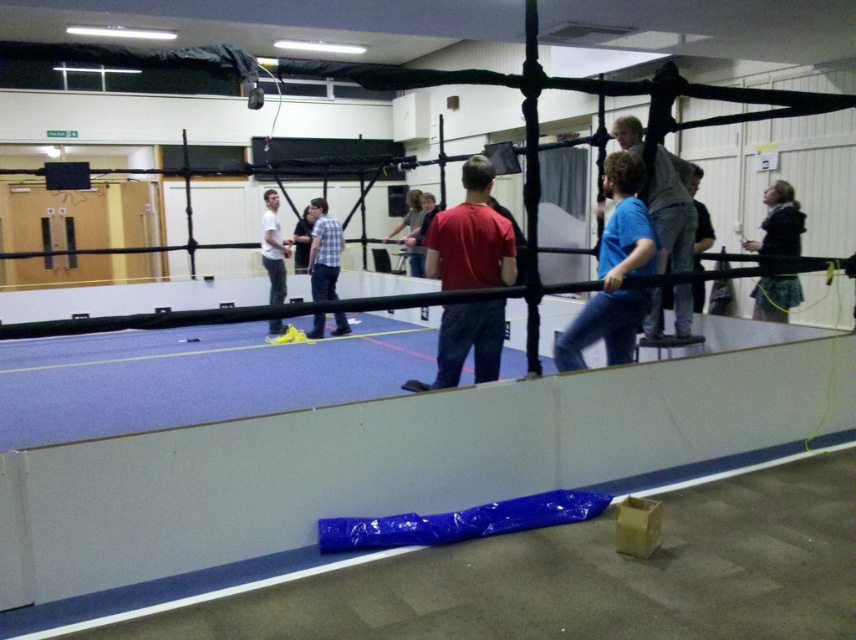
Question: Does blue matte shirt at center have a larger size compared to plaid fabric shirt at center?

Choices:
 (A) no
 (B) yes

Answer: (A)

Question: Which of the following is the farthest from the observer?

Choices:
 (A) (434, 264)
 (B) (284, 330)
 (C) (599, 339)
 (D) (310, 337)

Answer: (B)

Question: Which object is the closest to the white matte shirt at center?

Choices:
 (A) dark blue textured skirt at right
 (B) blue matte shirt at center
 (C) plaid fabric shirt at center

Answer: (C)

Question: Can you confirm if red matte shirt at center is positioned below plaid fabric shirt at center?

Choices:
 (A) yes
 (B) no

Answer: (A)

Question: Which object appears farthest from the camera in this image?

Choices:
 (A) blue matte shirt at center
 (B) dark blue textured skirt at right
 (C) white matte shirt at center

Answer: (C)

Question: Is blue matte shirt at center positioned in front of plaid fabric shirt at center?

Choices:
 (A) yes
 (B) no

Answer: (A)